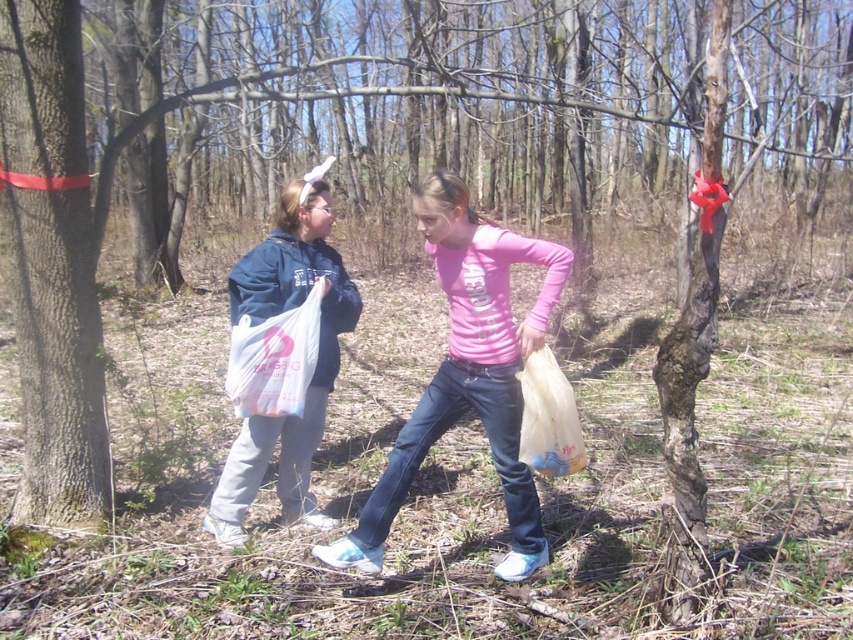
Question: In this image, where is smooth bark tree at left located relative to pink matte shirt at center?

Choices:
 (A) left
 (B) right

Answer: (A)

Question: Considering the relative positions of smooth bark tree at left and pink matte shirt at center in the image provided, where is smooth bark tree at left located with respect to pink matte shirt at center?

Choices:
 (A) above
 (B) below

Answer: (A)

Question: Estimate the real-world distances between objects in this image. Which object is closer to the matte blue hoodie at center?

Choices:
 (A) smooth bark tree at left
 (B) white plastic bag at center
 (C) translucent plastic bag at lower center

Answer: (B)

Question: Is matte blue hoodie at center thinner than white plastic bag at center?

Choices:
 (A) no
 (B) yes

Answer: (A)

Question: Which point is closer to the camera?

Choices:
 (A) smooth bark tree at left
 (B) matte blue hoodie at center
 (C) pink matte shirt at center

Answer: (C)

Question: Which is nearer to the translucent plastic bag at lower center?

Choices:
 (A) matte blue hoodie at center
 (B) white plastic bag at center

Answer: (B)